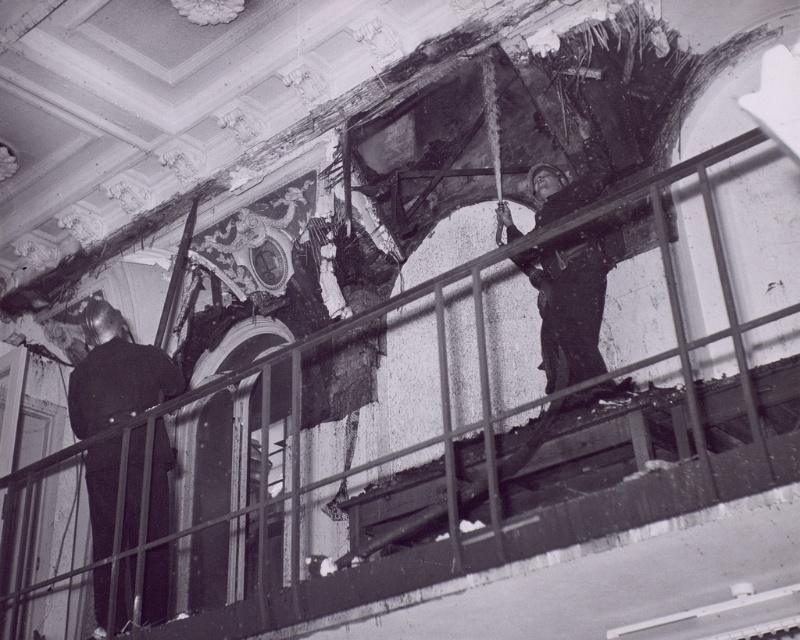
You are a rescue worker in the damaged building. You see the dark fabric uniform at left and the dark fabric helmet at upper center. Which object is located higher up in the scene?

The dark fabric helmet at upper center is higher up than the dark fabric uniform at left.

You are a rescue worker assessing the damaged building. You notice a dark fabric uniform at left near point (114, 372). Is there enough space between the dark fabric uniform at left and the staircase with metal railings to safely move a stretcher through?

The dark fabric uniform at left is positioned at point (114, 372). Since the Objects Description specifies its exact location but does not mention any obstruction or insufficient space relative to the staircase with metal railings, there is likely sufficient space to move a stretcher safely.